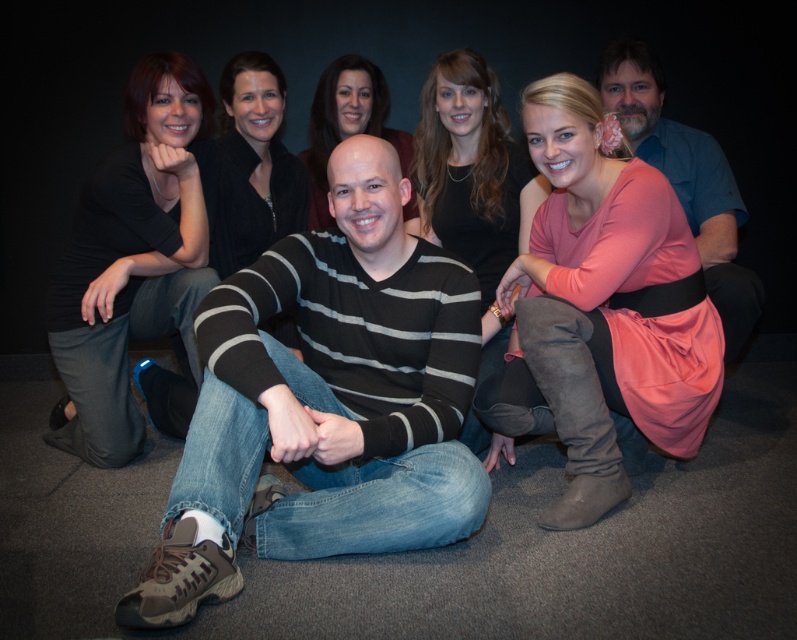
Consider the image. You are a photographer standing 1.5 meters away from the camera. You want to take a photo of the matte black shirt at left. Can you reach the camera to adjust it without moving your position?

The distance between the matte black shirt at left and the camera is 1.95 meters. Since you are 1.5 meters away from the camera, the total distance between you and the matte black shirt at left would be 1.95 meters plus your distance to the camera. This means you are 3.45 meters away from the matte black shirt at left, so you cannot reach the camera to adjust it without moving.